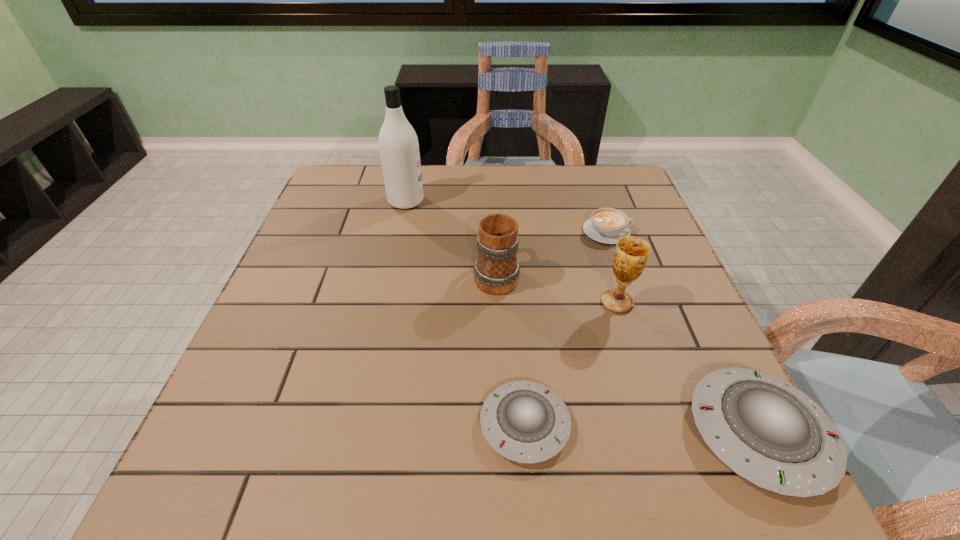
The width and height of the screenshot is (960, 540). Find the location of `the shorter saucer`. the shorter saucer is located at coordinates (526, 422).

I want to click on the right saucer, so click(768, 432).

Where is `the taller saucer`? This screenshot has height=540, width=960. the taller saucer is located at coordinates (768, 432).

You are a GUI agent. You are given a task and a screenshot of the screen. Output one action in this format:
    pyautogui.click(x=<x>, y=<y>)
    Task: Click on the cappuccino
    This screenshot has width=960, height=540.
    Given the screenshot: What is the action you would take?
    pyautogui.click(x=607, y=225)

Find the location of a particular element. the tallest object is located at coordinates (398, 143).

This screenshot has height=540, width=960. I want to click on the leftmost object, so [x=398, y=143].

At what (x,y) coordinates should I click in order to perform the action: click on mug. Please return your answer as a coordinate pair (x, y). Image resolution: width=960 pixels, height=540 pixels. Looking at the image, I should click on (496, 270).

Identify the location of chalice. This screenshot has width=960, height=540. (631, 253).

In order to click on free location located on the back of the shorter saucer in this screenshot , I will do `click(511, 254)`.

Find the location of a particular element. The height and width of the screenshot is (540, 960). free space located 0.110m on the left of the right saucer is located at coordinates (624, 433).